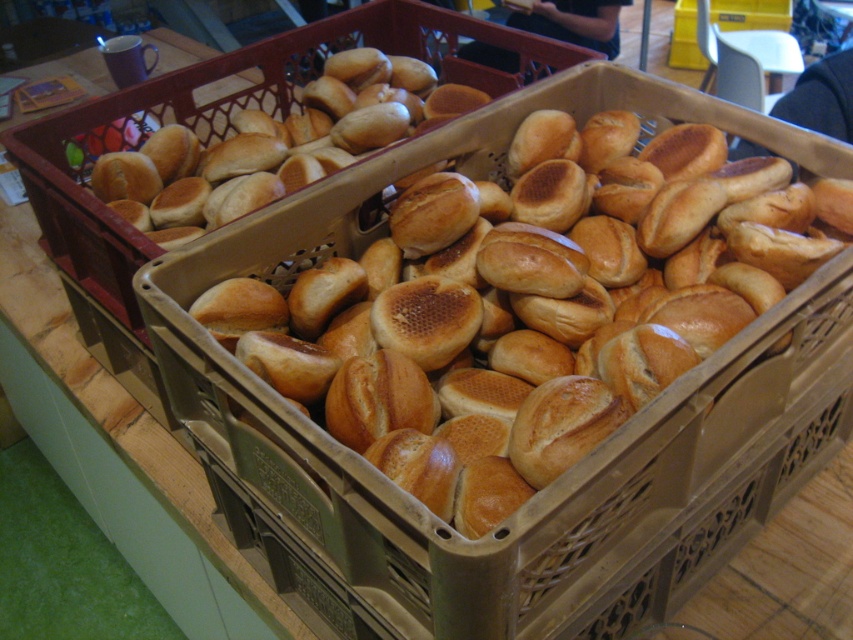
Question: Which point appears closest to the camera in this image?

Choices:
 (A) (347, 61)
 (B) (474, 204)

Answer: (B)

Question: Observing the image, what is the correct spatial positioning of golden brown crusty bread at center in reference to golden brown crusty bread at upper left?

Choices:
 (A) above
 (B) below

Answer: (B)

Question: Can you confirm if golden brown crusty bread at center is wider than golden brown plastic basket at center?

Choices:
 (A) no
 (B) yes

Answer: (A)

Question: Is golden brown crusty bread at center to the right of golden brown crusty bread at upper left from the viewer's perspective?

Choices:
 (A) yes
 (B) no

Answer: (A)

Question: Which object appears closest to the camera in this image?

Choices:
 (A) golden brown crusty bread at center
 (B) golden brown crusty bread at upper left
 (C) golden brown plastic basket at center

Answer: (A)

Question: Which of the following is the farthest from the observer?

Choices:
 (A) golden brown crusty bread at center
 (B) golden brown crusty bread at upper left

Answer: (B)